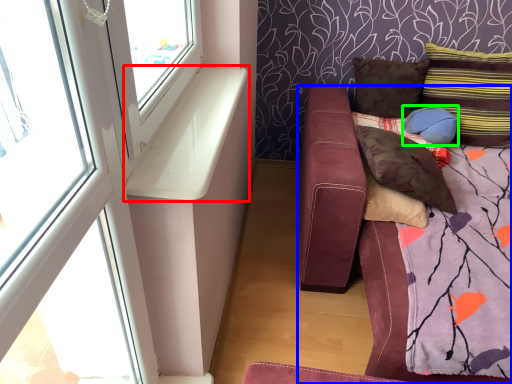
Question: Estimate the real-world distances between objects in this image. Which object is closer to window sill (highlighted by a red box), studio couch (highlighted by a blue box) or pillow (highlighted by a green box)?

Choices:
 (A) studio couch
 (B) pillow

Answer: (A)